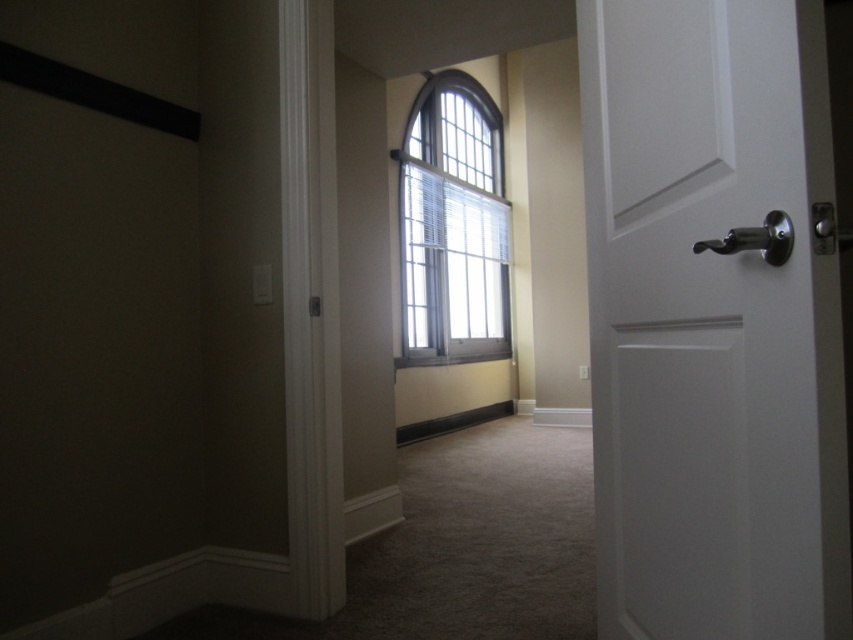
You are a delivery person trying to enter the house through the white matte door at right. You notice the clear glass window at center. Which object is lower in the image?

The white matte door at right is located below the clear glass window at center, so the white matte door at right is lower in the image.

You are a delivery person holding a large package that is 30 inches wide. You approach the white matte door at right. Can you fit the package through the door opening without bending or rotating it?

The white matte door at right is 27.82 inches from viewer. Since the package is 30 inches wide, which is wider than the door opening, it cannot fit through without bending or rotating.

You are a delivery person carrying a large package that is 10 cm thick. You need to slide it through either the white matte door at right or the clear glass window at center. Which one can the package fit through based on their thickness?

The white matte door at right is thinner than the clear glass window at center. Since the package is 10 cm thick, it can only fit through the clear glass window at center as it is thicker than the door.